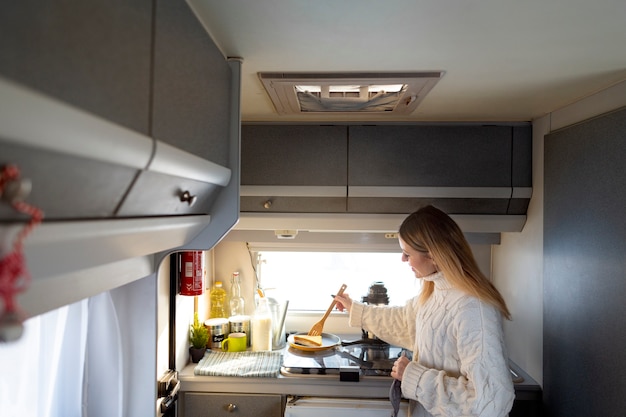
Find the location of `fire extuingisher`. fire extuingisher is located at coordinates (191, 284).